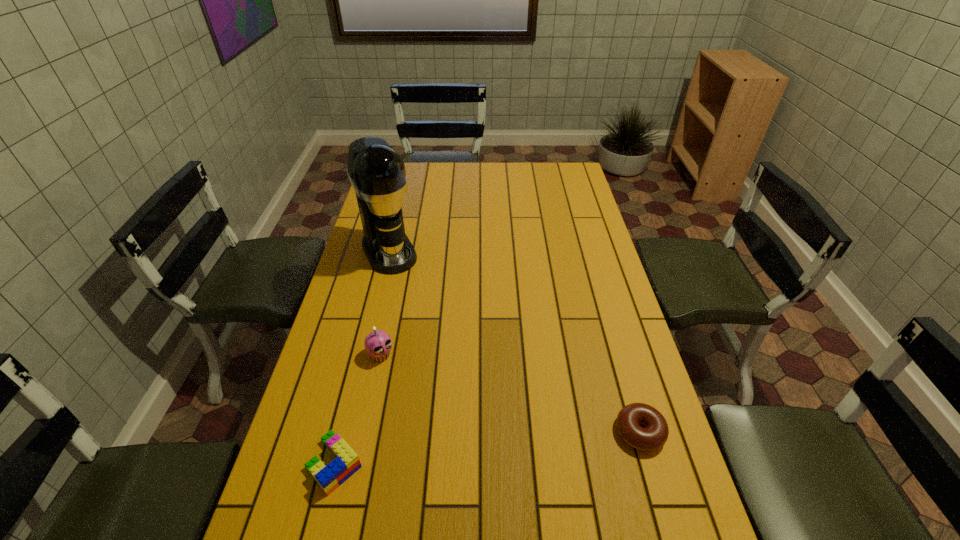
Identify the location of free region located 0.070m place cup under the spout of the tallest object. The width and height of the screenshot is (960, 540). (404, 285).

Identify the location of vacant space located 0.230m on the face of the cupcake. The height and width of the screenshot is (540, 960). (442, 417).

You are a GUI agent. You are given a task and a screenshot of the screen. Output one action in this format:
    pyautogui.click(x=<x>, y=<y>)
    Task: Click on the free space located 0.050m on the face of the cupcake
    This screenshot has width=960, height=540.
    Given the screenshot: What is the action you would take?
    pyautogui.click(x=399, y=374)

Identify the location of free location located on the face of the cupcake. (410, 385).

Identify the location of Lego located in the left edge section of the desktop. Image resolution: width=960 pixels, height=540 pixels. (346, 463).

Locate an element on the screen. This screenshot has height=540, width=960. coffee maker that is at the left edge is located at coordinates tap(377, 173).

At what (x,y) coordinates should I click in order to perform the action: click on cupcake that is positioned at the left edge. Please return your answer as a coordinate pair (x, y). Looking at the image, I should click on (378, 344).

Locate an element on the screen. object located in the right edge section of the desktop is located at coordinates (655, 434).

Image resolution: width=960 pixels, height=540 pixels. I want to click on free space at the far edge of the desktop, so click(514, 166).

I want to click on vacant space at the left edge, so click(x=304, y=455).